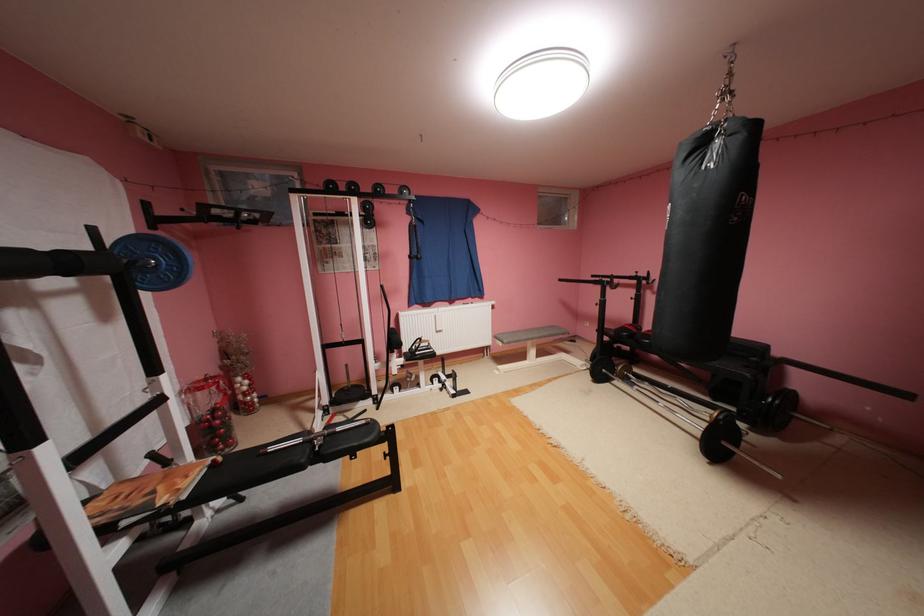
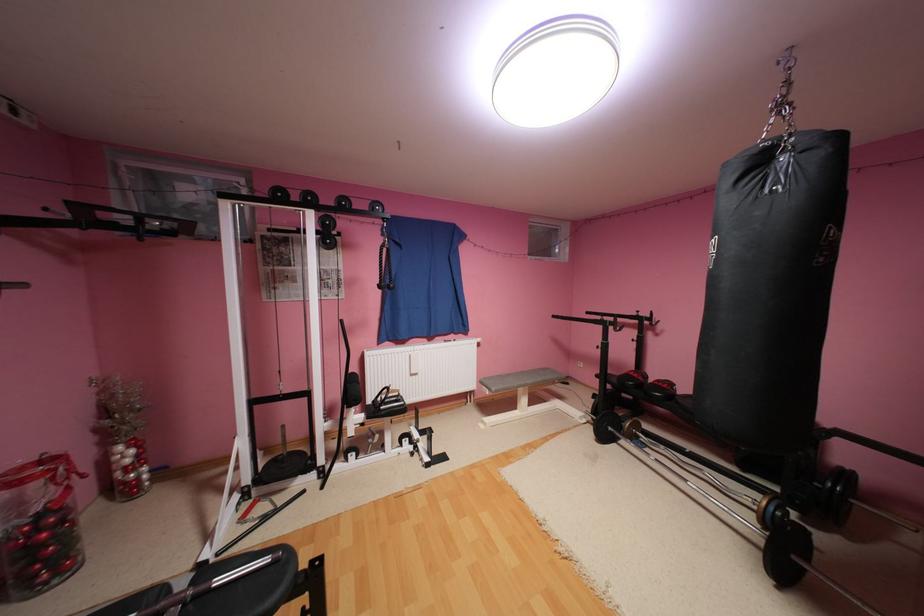
In the second image, find the point that corresponds to [544,334] in the first image.

(538, 382)